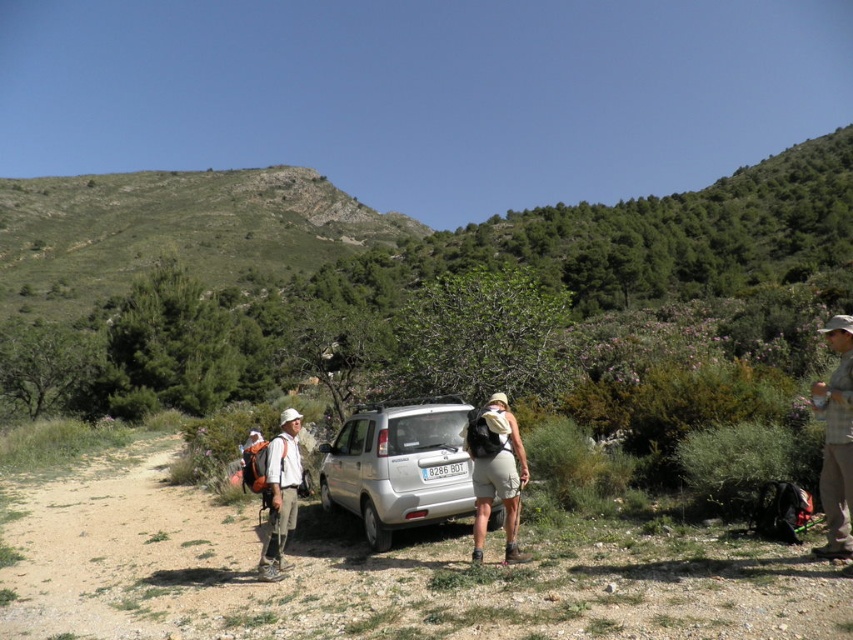
Question: Which is farther from the gravel path at center?

Choices:
 (A) matte khaki shorts at center
 (B) silver metallic car at center
 (C) camouflage fabric backpack at left
 (D) plaid shirt at right

Answer: (D)

Question: Is plaid shirt at right to the right of matte khaki shorts at center from the viewer's perspective?

Choices:
 (A) no
 (B) yes

Answer: (B)

Question: Which object is positioned farthest from the plaid shirt at right?

Choices:
 (A) camouflage fabric backpack at left
 (B) matte khaki shorts at center

Answer: (A)

Question: Which point appears farthest from the camera in this image?

Choices:
 (A) (109, 566)
 (B) (286, 529)
 (C) (514, 557)
 (D) (386, 529)

Answer: (A)

Question: Can you confirm if silver metallic car at center is positioned to the right of camouflage fabric backpack at left?

Choices:
 (A) no
 (B) yes

Answer: (B)

Question: Is the position of silver metallic car at center less distant than that of matte khaki shorts at center?

Choices:
 (A) no
 (B) yes

Answer: (A)